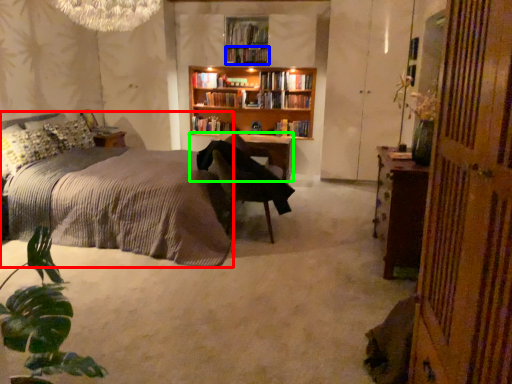
Question: Which object is positioned closest to bed (highlighted by a red box)? Select from book (highlighted by a blue box) and table (highlighted by a green box).

Choices:
 (A) book
 (B) table

Answer: (B)